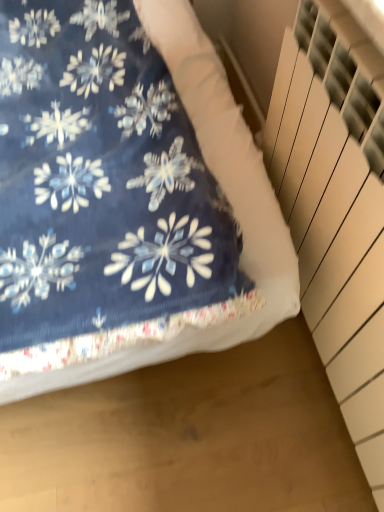
Question: Should I look upward or downward to see navy blue fabric at upper left?

Choices:
 (A) down
 (B) up

Answer: (B)

Question: Is white textured stairwell at right completely or partially inside navy blue fabric at upper left?

Choices:
 (A) yes
 (B) no

Answer: (B)

Question: Considering the relative sizes of navy blue fabric at upper left and white textured stairwell at right in the image provided, is navy blue fabric at upper left smaller than white textured stairwell at right?

Choices:
 (A) yes
 (B) no

Answer: (B)

Question: Is navy blue fabric at upper left shorter than white textured stairwell at right?

Choices:
 (A) yes
 (B) no

Answer: (B)

Question: Is navy blue fabric at upper left turned away from white textured stairwell at right?

Choices:
 (A) no
 (B) yes

Answer: (A)

Question: From the image's perspective, is navy blue fabric at upper left under white textured stairwell at right?

Choices:
 (A) no
 (B) yes

Answer: (A)

Question: Does navy blue fabric at upper left have a greater width compared to white textured stairwell at right?

Choices:
 (A) yes
 (B) no

Answer: (A)

Question: Is white textured stairwell at right wider than navy blue fabric at upper left?

Choices:
 (A) yes
 (B) no

Answer: (B)

Question: Is white textured stairwell at right further to camera compared to navy blue fabric at upper left?

Choices:
 (A) yes
 (B) no

Answer: (B)

Question: Does white textured stairwell at right have a lesser height compared to navy blue fabric at upper left?

Choices:
 (A) yes
 (B) no

Answer: (A)

Question: Considering the relative sizes of white textured stairwell at right and navy blue fabric at upper left in the image provided, is white textured stairwell at right taller than navy blue fabric at upper left?

Choices:
 (A) yes
 (B) no

Answer: (B)

Question: Does white textured stairwell at right have a smaller size compared to navy blue fabric at upper left?

Choices:
 (A) no
 (B) yes

Answer: (B)

Question: Is white textured stairwell at right positioned with its back to navy blue fabric at upper left?

Choices:
 (A) no
 (B) yes

Answer: (A)

Question: Is navy blue fabric at upper left inside the boundaries of white textured stairwell at right, or outside?

Choices:
 (A) inside
 (B) outside

Answer: (B)